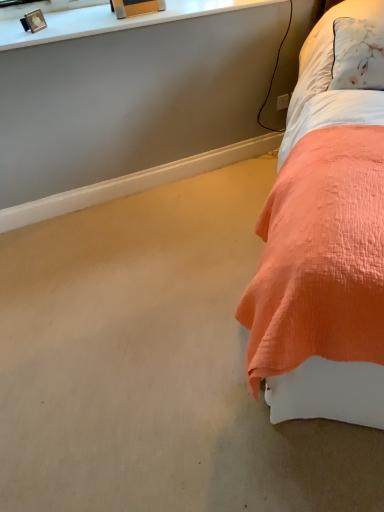
What is the approximate height of metallic gold picture frame at upper left?

The height of metallic gold picture frame at upper left is 4.24 inches.

In order to face coral quilted bed at right, should I rotate leftwards or rightwards?

It's best to rotate right around 21.150 degrees.

The image size is (384, 512). Find the location of `metallic gold picture frame at upper left`. metallic gold picture frame at upper left is located at coordinates (33, 21).

Is coral quilted bed at right at the back of metallic gold picture frame at upper left?

No, metallic gold picture frame at upper left is not facing away from coral quilted bed at right.

Can you confirm if metallic gold picture frame at upper left is positioned to the right of coral quilted bed at right?

No.

Considering the points (34, 24) and (302, 162), which point is behind, point (34, 24) or point (302, 162)?

Positioned behind is point (34, 24).

Considering the positions of point (278, 101) and point (27, 13), is point (278, 101) closer or farther from the camera than point (27, 13)?

Point (278, 101) is farther from the camera than point (27, 13).

Can you see white plastic power outlet at upper right touching metallic gold picture frame at upper left?

No.

Which of these two, white plastic power outlet at upper right or metallic gold picture frame at upper left, stands shorter?

white plastic power outlet at upper right.

Could you measure the distance between white plastic power outlet at upper right and metallic gold picture frame at upper left?

white plastic power outlet at upper right and metallic gold picture frame at upper left are 4.54 feet apart from each other.

From the image's perspective, who appears lower, metallic gold picture frame at upper left or white plastic power outlet at upper right?

white plastic power outlet at upper right is shown below in the image.

Is metallic gold picture frame at upper left surrounding white plastic power outlet at upper right?

Actually, white plastic power outlet at upper right is outside metallic gold picture frame at upper left.

Based on the photo, is metallic gold picture frame at upper left touching white plastic power outlet at upper right?

No, metallic gold picture frame at upper left is not with white plastic power outlet at upper right.

From a real-world perspective, is metallic gold picture frame at upper left below white plastic power outlet at upper right?

No, from a real-world perspective, metallic gold picture frame at upper left is not beneath white plastic power outlet at upper right.

Is white plastic power outlet at upper right positioned in front of coral quilted bed at right?

No, white plastic power outlet at upper right is further to the viewer.

Considering the relative sizes of white plastic power outlet at upper right and coral quilted bed at right in the image provided, is white plastic power outlet at upper right wider than coral quilted bed at right?

Incorrect, the width of white plastic power outlet at upper right does not surpass that of coral quilted bed at right.

Is white plastic power outlet at upper right far from coral quilted bed at right?

Yes, white plastic power outlet at upper right and coral quilted bed at right are quite far apart.

Is white plastic power outlet at upper right facing towards coral quilted bed at right?

Yes, white plastic power outlet at upper right is turned towards coral quilted bed at right.

The height and width of the screenshot is (512, 384). I want to click on power outlet behind the coral quilted bed at right, so click(283, 102).

Which of these two, coral quilted bed at right or white plastic power outlet at upper right, is wider?

Wider between the two is coral quilted bed at right.

Considering the relative positions of coral quilted bed at right and white plastic power outlet at upper right in the image provided, is coral quilted bed at right to the right of white plastic power outlet at upper right from the viewer's perspective?

Yes.

From the image's perspective, does coral quilted bed at right appear lower than metallic gold picture frame at upper left?

Indeed, from the image's perspective, coral quilted bed at right is shown beneath metallic gold picture frame at upper left.

Between coral quilted bed at right and metallic gold picture frame at upper left, which one has smaller width?

Thinner between the two is metallic gold picture frame at upper left.

Is coral quilted bed at right directly adjacent to metallic gold picture frame at upper left?

No.

From a real-world perspective, which object stands above the other?

metallic gold picture frame at upper left, from a real-world perspective.

Locate an element on the screen. bed that appears below the metallic gold picture frame at upper left (from the image's perspective) is located at coordinates (323, 249).

Find the location of a particular element. Image resolution: width=384 pixels, height=512 pixels. picture frame in front of the white plastic power outlet at upper right is located at coordinates (33, 21).

Which object lies further to the anchor point coral quilted bed at right, metallic gold picture frame at upper left or white plastic power outlet at upper right?

Among the two, metallic gold picture frame at upper left is located further to coral quilted bed at right.

From the image, which object appears to be nearer to coral quilted bed at right, white plastic power outlet at upper right or metallic gold picture frame at upper left?

white plastic power outlet at upper right lies closer to coral quilted bed at right than the other object.

Considering their positions, is coral quilted bed at right positioned further to white plastic power outlet at upper right than metallic gold picture frame at upper left?

Among the two, metallic gold picture frame at upper left is located further to white plastic power outlet at upper right.

Which object lies further to the anchor point metallic gold picture frame at upper left, coral quilted bed at right or white plastic power outlet at upper right?

coral quilted bed at right is positioned further to the anchor metallic gold picture frame at upper left.

Considering their positions, is white plastic power outlet at upper right positioned closer to metallic gold picture frame at upper left than coral quilted bed at right?

The object closer to metallic gold picture frame at upper left is white plastic power outlet at upper right.

When comparing their distances from white plastic power outlet at upper right, does metallic gold picture frame at upper left or coral quilted bed at right seem closer?

The object closer to white plastic power outlet at upper right is coral quilted bed at right.

You are a GUI agent. You are given a task and a screenshot of the screen. Output one action in this format:
    pyautogui.click(x=<x>, y=<y>)
    Task: Click on the picture frame positioned between coral quilted bed at right and white plastic power outlet at upper right from near to far
    This screenshot has height=512, width=384.
    Given the screenshot: What is the action you would take?
    pyautogui.click(x=33, y=21)